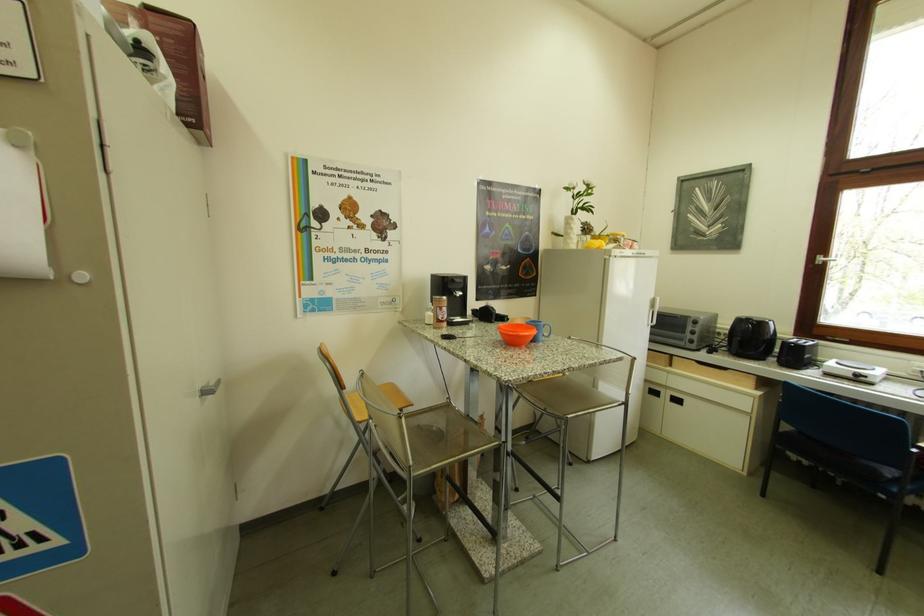
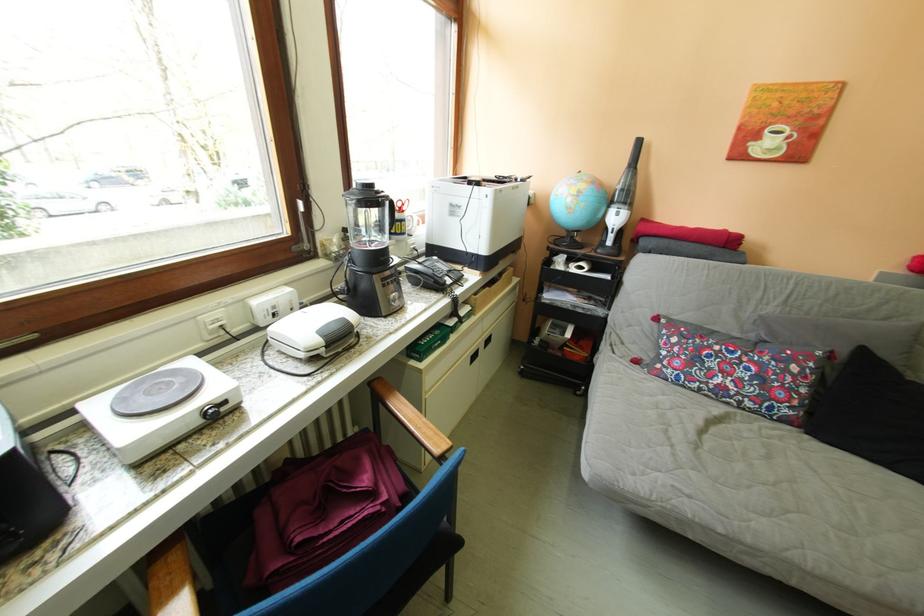
The point at (879, 379) is marked in the first image. Where is the corresponding point in the second image?

(237, 406)